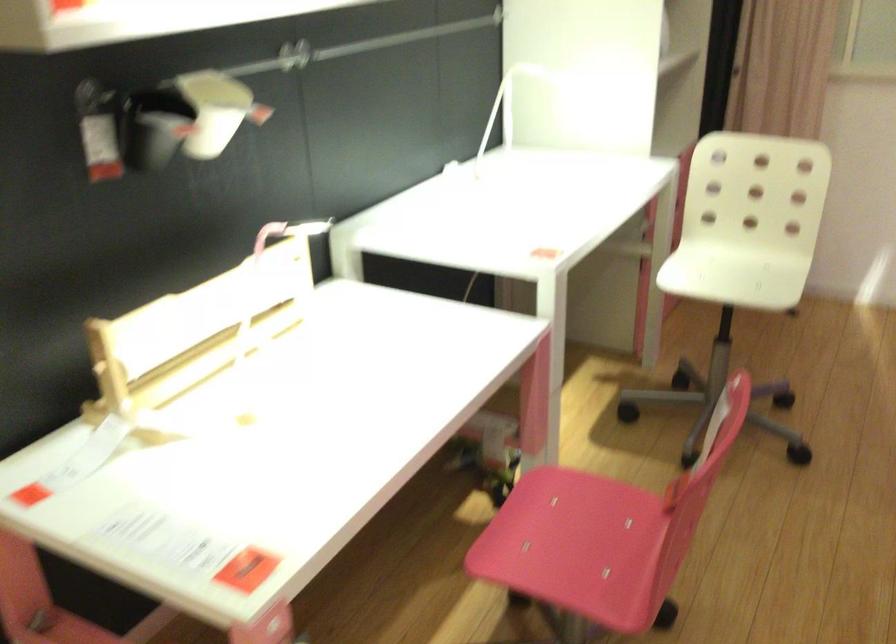
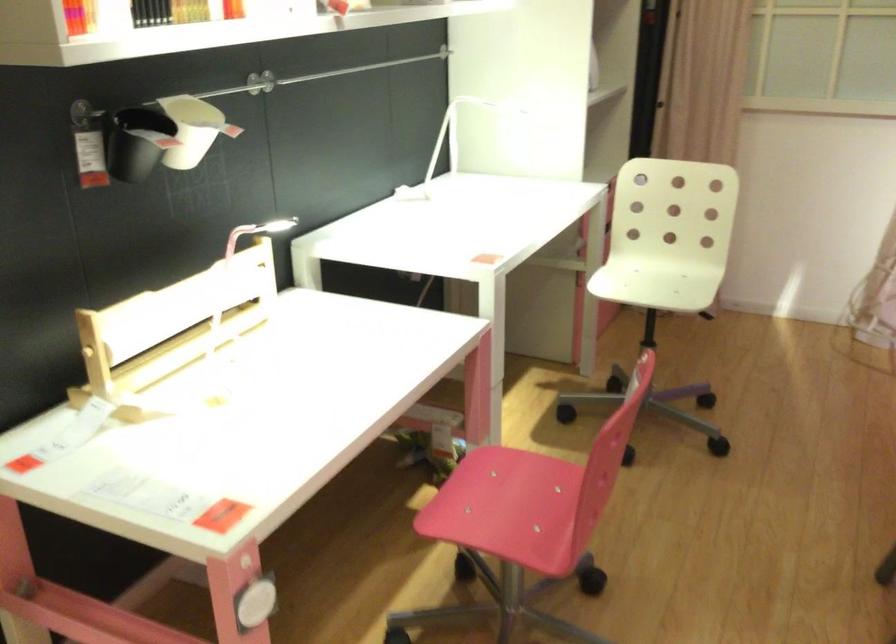
Question: The camera is either moving clockwise (left) or counter-clockwise (right) around the object. The first image is from the beginning of the video and the second image is from the end. Is the camera moving left or right when shooting the video?

Choices:
 (A) Left
 (B) Right

Answer: (A)